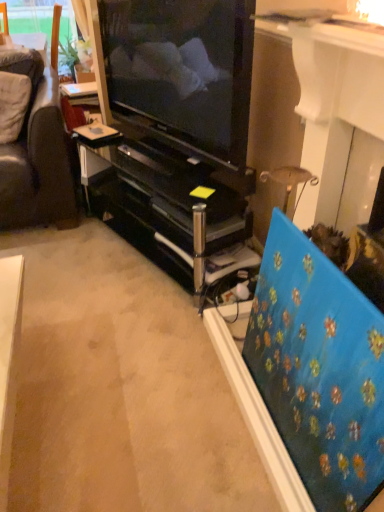
Question: Is blue textured canvas at right bigger or smaller than black glossy tv cabinet at center?

Choices:
 (A) small
 (B) big

Answer: (A)

Question: Considering the positions of blue textured canvas at right and black glossy tv cabinet at center in the image, is blue textured canvas at right taller or shorter than black glossy tv cabinet at center?

Choices:
 (A) tall
 (B) short

Answer: (A)

Question: Based on their relative distances, which object is nearer to the matte black television at center?

Choices:
 (A) black glossy tv cabinet at center
 (B) blue textured canvas at right

Answer: (A)

Question: Considering the real-world distances, which object is farthest from the blue textured canvas at right?

Choices:
 (A) matte black television at center
 (B) black glossy tv cabinet at center

Answer: (A)